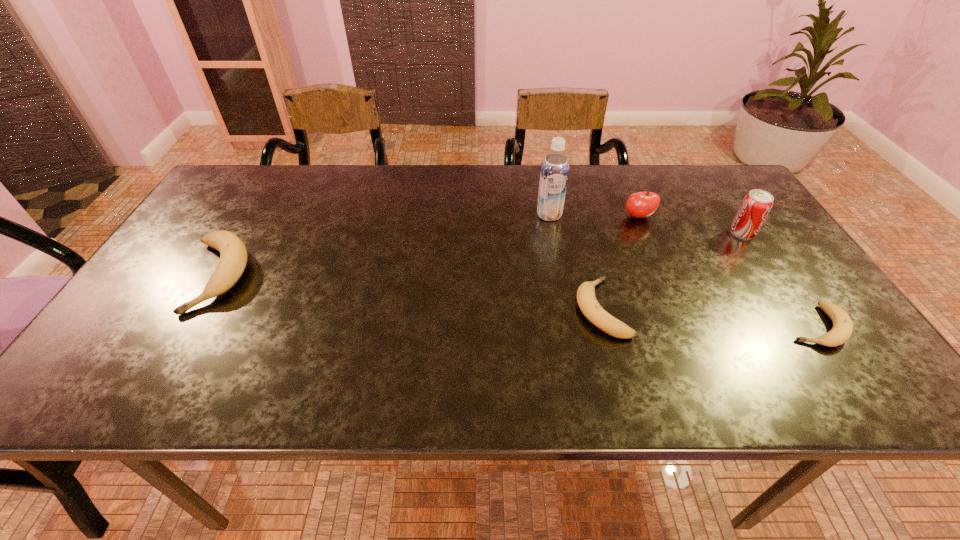
Image resolution: width=960 pixels, height=540 pixels. Find the location of `the third shortest object`. the third shortest object is located at coordinates (233, 255).

Find the location of a particular element. the leftmost object is located at coordinates (233, 255).

In order to click on the fifth tallest object in this screenshot , I will do `click(588, 304)`.

The width and height of the screenshot is (960, 540). Identify the location of the second banana from right to left. (588, 304).

The height and width of the screenshot is (540, 960). In order to click on the shortest object in this screenshot , I will do `click(842, 329)`.

Find the location of a particular element. the shortest banana is located at coordinates (842, 329).

Find the location of `soda can`. soda can is located at coordinates (756, 205).

Find the location of a particular element. This screenshot has height=540, width=960. the second tallest object is located at coordinates (756, 205).

Where is `the tallest object`? This screenshot has width=960, height=540. the tallest object is located at coordinates (554, 174).

Where is `the third object from right to left`? the third object from right to left is located at coordinates (641, 204).